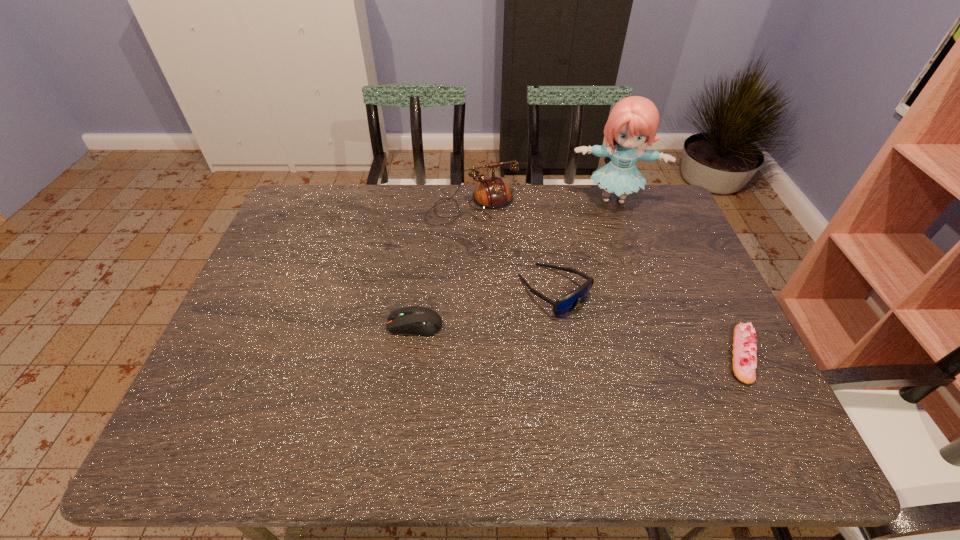
In order to click on object present at the near edge in this screenshot , I will do `click(744, 362)`.

Locate an element on the screen. The width and height of the screenshot is (960, 540). eclair located at the right edge is located at coordinates (744, 362).

Where is `doll at the right edge`? doll at the right edge is located at coordinates (634, 120).

Image resolution: width=960 pixels, height=540 pixels. Find the location of `object that is at the far right corner`. object that is at the far right corner is located at coordinates (634, 120).

The width and height of the screenshot is (960, 540). I want to click on object situated at the near right corner, so click(x=744, y=362).

Image resolution: width=960 pixels, height=540 pixels. I want to click on vacant space at the far edge of the desktop, so click(x=587, y=199).

Locate an element on the screen. The height and width of the screenshot is (540, 960). vacant space at the near edge is located at coordinates (621, 403).

This screenshot has height=540, width=960. In order to click on free point at the left edge in this screenshot , I will do `click(300, 286)`.

Locate an element on the screen. This screenshot has width=960, height=540. blank space at the right edge of the desktop is located at coordinates (670, 235).

This screenshot has width=960, height=540. In the image, there is a desktop. Find the location of `free region at the far right corner`. free region at the far right corner is located at coordinates (638, 220).